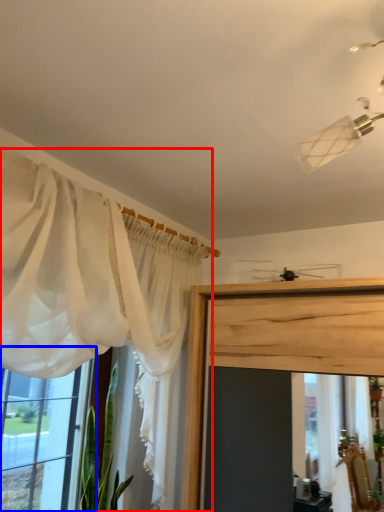
Question: Which of the following is the farthest to the observer, curtain (highlighted by a red box) or window (highlighted by a blue box)?

Choices:
 (A) curtain
 (B) window

Answer: (B)